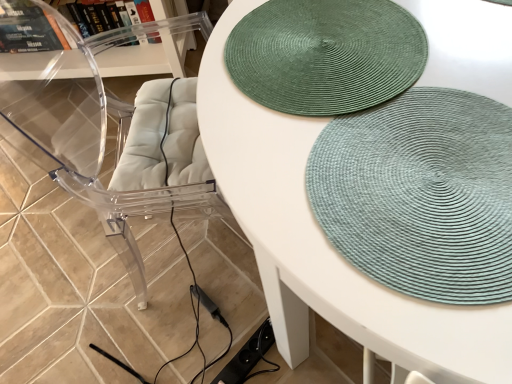
Question: Which direction should I rotate to face green woven mat at upper center, which is the first mat from top to bottom, — up or down?

Choices:
 (A) down
 (B) up

Answer: (B)

Question: From a real-world perspective, is green woven mat at upper center, which is the first mat from top to bottom, physically above transparent plastic shelf at upper left?

Choices:
 (A) yes
 (B) no

Answer: (A)

Question: Is green woven mat at upper center, which is the first mat from top to bottom, next to transparent plastic shelf at upper left?

Choices:
 (A) yes
 (B) no

Answer: (B)

Question: Does green woven mat at upper center, the 2th mat ordered from the bottom, appear on the left side of transparent plastic shelf at upper left?

Choices:
 (A) no
 (B) yes

Answer: (A)

Question: Does green woven mat at upper center, which is the first mat from top to bottom, come in front of transparent plastic shelf at upper left?

Choices:
 (A) no
 (B) yes

Answer: (B)

Question: Does green woven mat at upper center, which is the first mat from top to bottom, have a greater height compared to transparent plastic shelf at upper left?

Choices:
 (A) no
 (B) yes

Answer: (A)

Question: Is green woven mat at upper center, which is the first mat from top to bottom, shorter than transparent plastic shelf at upper left?

Choices:
 (A) no
 (B) yes

Answer: (B)

Question: From the image's perspective, is green woven placemat at upper center located beneath green woven mat at upper center, which is the first mat from top to bottom?

Choices:
 (A) yes
 (B) no

Answer: (A)

Question: From a real-world perspective, is green woven placemat at upper center physically above green woven mat at upper center, the 2th mat ordered from the bottom?

Choices:
 (A) yes
 (B) no

Answer: (B)

Question: Considering the relative sizes of green woven placemat at upper center and green woven mat at upper center, the 2th mat ordered from the bottom, in the image provided, is green woven placemat at upper center smaller than green woven mat at upper center, the 2th mat ordered from the bottom,?

Choices:
 (A) yes
 (B) no

Answer: (B)

Question: Is green woven mat at upper center, which is the first mat from top to bottom, a part of green woven placemat at upper center?

Choices:
 (A) yes
 (B) no

Answer: (A)

Question: From a real-world perspective, is green woven placemat at upper center physically below green woven mat at upper center, which is the first mat from top to bottom?

Choices:
 (A) yes
 (B) no

Answer: (A)

Question: Does green woven placemat at upper center have a lesser height compared to green woven mat at upper center, which is the first mat from top to bottom?

Choices:
 (A) no
 (B) yes

Answer: (A)

Question: Is transparent acrylic swivel chair at left positioned in front of green woven placemat at upper center?

Choices:
 (A) no
 (B) yes

Answer: (A)